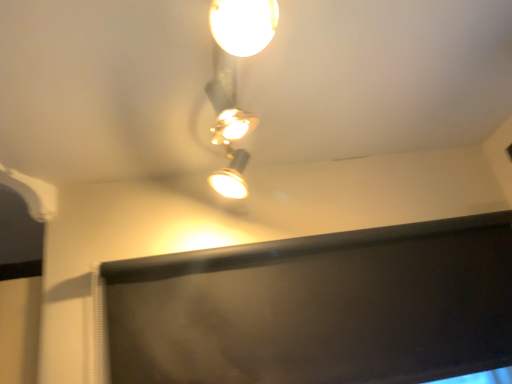
Where is `matte white spotlight at upper center`? matte white spotlight at upper center is located at coordinates click(234, 80).

Describe the element at coordinates (234, 80) in the screenshot. I see `matte white spotlight at upper center` at that location.

I want to click on matte white spotlight at upper center, so click(x=234, y=80).